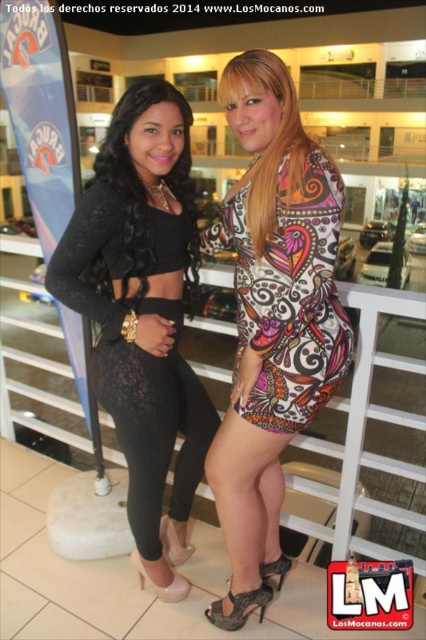
You are a photographer at the mall and need to locate the black lace dress at left. According to the coordinates provided, where exactly is it positioned in the image?

The black lace dress at left is positioned at coordinates point (143, 314).

You are a photographer setting up a shoot in a mall. You have two dresses to photograph, the multicolored printed dress at center and the matte black dress at center. The camera you are using has a limited focus range that can only accommodate one dress size. Based on the scene, which dress should you focus on to ensure it fills the frame properly?

The multicolored printed dress at center is bigger than the matte black dress at center, so focusing on the multicolored printed dress at center will ensure it fills the frame properly.

You are a photographer setting up a shoot in the mall. You need to position a light to the right of both the black lace leggings at center and the matte black dress at center. Is this possible given their positions?

The black lace leggings at center are to the left of the matte black dress at center, so positioning a light to the right of both is possible as the light can be placed to the right side of the matte black dress at center.